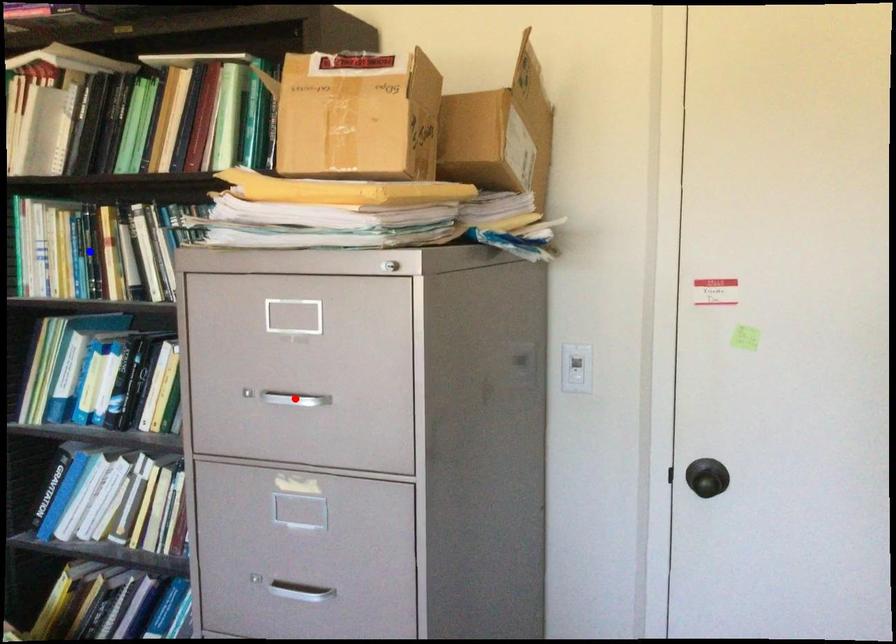
Question: In the image, two points are highlighted. Which point is nearer to the camera? Reply with the corresponding letter.

Choices:
 (A) blue point
 (B) red point

Answer: (B)